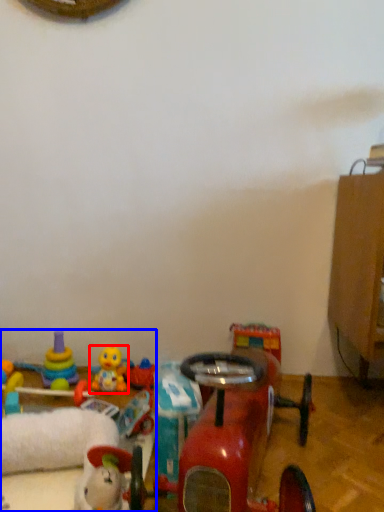
Question: Which point is further to the camera, toy (highlighted by a red box) or toy (highlighted by a blue box)?

Choices:
 (A) toy
 (B) toy

Answer: (A)